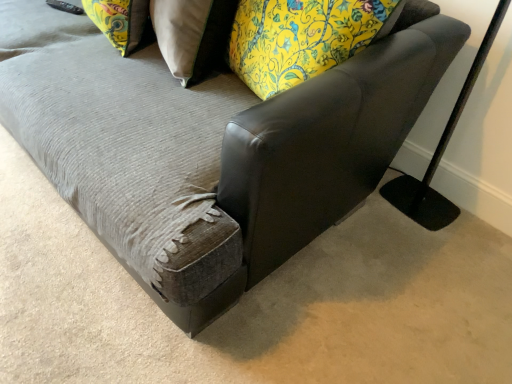
Question: From the image's perspective, is floral fabric pillow at upper left, the second pillow viewed from the right, located beneath black matte table lamp at right?

Choices:
 (A) no
 (B) yes

Answer: (A)

Question: Is floral fabric pillow at upper left, which is the 1th pillow from left to right, oriented towards black matte table lamp at right?

Choices:
 (A) yes
 (B) no

Answer: (B)

Question: From a real-world perspective, is floral fabric pillow at upper left, the second pillow viewed from the right, beneath black matte table lamp at right?

Choices:
 (A) no
 (B) yes

Answer: (A)

Question: Considering the relative positions of floral fabric pillow at upper left, the second pillow viewed from the right, and black matte table lamp at right in the image provided, is floral fabric pillow at upper left, the second pillow viewed from the right, to the left of black matte table lamp at right from the viewer's perspective?

Choices:
 (A) yes
 (B) no

Answer: (A)

Question: Is black matte table lamp at right surrounded by floral fabric pillow at upper left, which is the 1th pillow from left to right?

Choices:
 (A) no
 (B) yes

Answer: (A)

Question: Is black matte table lamp at right in front of or behind floral fabric pillow at upper center, the 1th pillow when ordered from right to left, in the image?

Choices:
 (A) behind
 (B) front

Answer: (B)

Question: In the image, is black matte table lamp at right on the left side or the right side of floral fabric pillow at upper center, placed as the 2th pillow when sorted from left to right?

Choices:
 (A) left
 (B) right

Answer: (B)

Question: In terms of width, does black matte table lamp at right look wider or thinner when compared to floral fabric pillow at upper center, the 1th pillow when ordered from right to left?

Choices:
 (A) wide
 (B) thin

Answer: (B)

Question: Considering the positions of black matte table lamp at right and floral fabric pillow at upper center, placed as the 2th pillow when sorted from left to right, in the image, is black matte table lamp at right taller or shorter than floral fabric pillow at upper center, placed as the 2th pillow when sorted from left to right,?

Choices:
 (A) tall
 (B) short

Answer: (A)

Question: From a real-world perspective, is leather swivel chair at center positioned above or below floral fabric pillow at upper center, the 1th pillow when ordered from right to left?

Choices:
 (A) below
 (B) above

Answer: (B)

Question: Is point (446, 49) closer or farther from the camera than point (163, 39)?

Choices:
 (A) closer
 (B) farther

Answer: (A)

Question: In terms of width, does leather swivel chair at center look wider or thinner when compared to floral fabric pillow at upper center, placed as the 2th pillow when sorted from left to right?

Choices:
 (A) thin
 (B) wide

Answer: (B)

Question: Considering the relative positions of leather swivel chair at center and floral fabric pillow at upper center, placed as the 2th pillow when sorted from left to right, in the image provided, is leather swivel chair at center to the left or to the right of floral fabric pillow at upper center, placed as the 2th pillow when sorted from left to right,?

Choices:
 (A) left
 (B) right

Answer: (B)

Question: From the image's perspective, is floral fabric pillow at upper left, which is the 1th pillow from left to right, above or below leather swivel chair at center?

Choices:
 (A) above
 (B) below

Answer: (A)

Question: From a real-world perspective, is floral fabric pillow at upper left, the second pillow viewed from the right, positioned above or below leather swivel chair at center?

Choices:
 (A) above
 (B) below

Answer: (B)